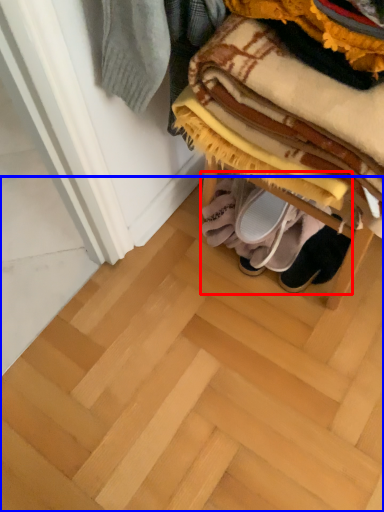
Question: Which object appears closest to the camera in this image, footwear (highlighted by a red box) or stair (highlighted by a blue box)?

Choices:
 (A) footwear
 (B) stair

Answer: (B)